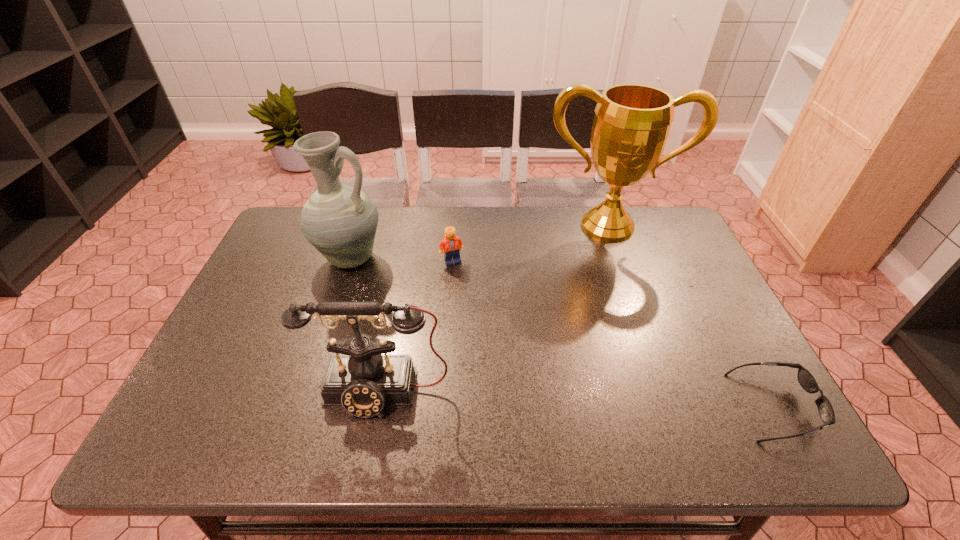
Find the location of a particular element. This screenshot has height=540, width=960. vacant space positioned 0.090m on the front-facing side of the award is located at coordinates (606, 264).

The image size is (960, 540). I want to click on blank space located on the handle side of the fourth shortest object, so click(x=387, y=283).

This screenshot has height=540, width=960. In order to click on free spot located 0.090m on the handle side of the fourth shortest object in this screenshot , I will do `click(394, 288)`.

Identify the location of free region located 0.210m on the handle side of the fourth shortest object. (423, 308).

What are the coordinates of `award located at the far edge` in the screenshot? It's located at (632, 122).

Locate an element on the screen. pitcher at the far edge is located at coordinates (340, 221).

Locate an element on the screen. telephone present at the near edge is located at coordinates (363, 381).

The image size is (960, 540). I want to click on sunglasses at the near edge, so click(x=805, y=378).

Where is `object that is positioned at the left edge`? Image resolution: width=960 pixels, height=540 pixels. object that is positioned at the left edge is located at coordinates (340, 221).

This screenshot has height=540, width=960. Find the location of `sunglasses located at the right edge`. sunglasses located at the right edge is located at coordinates (805, 378).